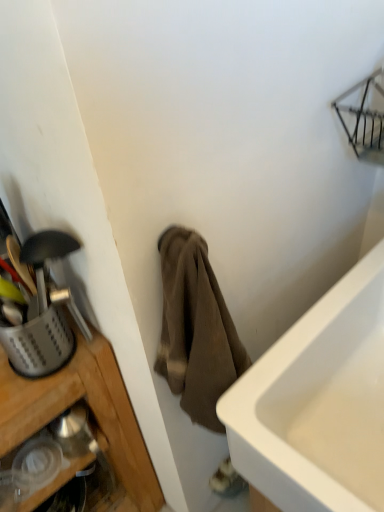
Question: Is silver/metallic utensil basket at left wider or thinner than brown cotton towel at center?

Choices:
 (A) thin
 (B) wide

Answer: (A)

Question: Do you think silver/metallic utensil basket at left is within brown cotton towel at center, or outside of it?

Choices:
 (A) inside
 (B) outside

Answer: (B)

Question: In the image, is silver/metallic utensil basket at left positioned in front of or behind brown cotton towel at center?

Choices:
 (A) behind
 (B) front

Answer: (A)

Question: From their relative heights in the image, would you say brown cotton towel at center is taller or shorter than silver/metallic utensil basket at left?

Choices:
 (A) tall
 (B) short

Answer: (A)

Question: From a real-world perspective, is brown cotton towel at center physically located above or below silver/metallic utensil basket at left?

Choices:
 (A) below
 (B) above

Answer: (A)

Question: Based on their positions, is brown cotton towel at center located to the left or right of silver/metallic utensil basket at left?

Choices:
 (A) left
 (B) right

Answer: (B)

Question: Considering their positions, is brown cotton towel at center located in front of or behind silver/metallic utensil basket at left?

Choices:
 (A) front
 (B) behind

Answer: (A)